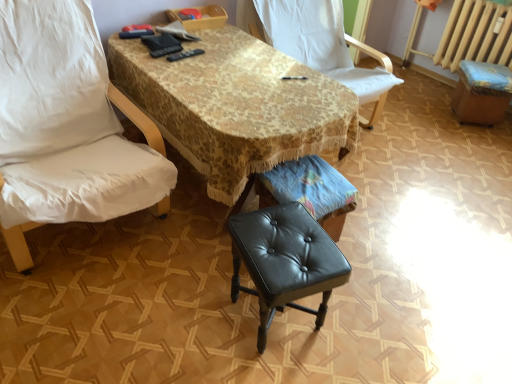
Question: Is black leather music stool at center oriented away from gold lace tablecloth at center?

Choices:
 (A) no
 (B) yes

Answer: (B)

Question: From a real-world perspective, does black leather music stool at center stand above gold lace tablecloth at center?

Choices:
 (A) yes
 (B) no

Answer: (B)

Question: Does black leather music stool at center have a smaller size compared to gold lace tablecloth at center?

Choices:
 (A) yes
 (B) no

Answer: (A)

Question: Does black leather music stool at center have a greater width compared to gold lace tablecloth at center?

Choices:
 (A) yes
 (B) no

Answer: (B)

Question: Is the depth of black leather music stool at center greater than that of gold lace tablecloth at center?

Choices:
 (A) yes
 (B) no

Answer: (A)

Question: Are black leather music stool at center and gold lace tablecloth at center far apart?

Choices:
 (A) no
 (B) yes

Answer: (A)

Question: From the image's perspective, is black leather music stool at center on top of black leather bar stool at lower right?

Choices:
 (A) yes
 (B) no

Answer: (B)

Question: From a real-world perspective, is black leather music stool at center beneath black leather bar stool at lower right?

Choices:
 (A) no
 (B) yes

Answer: (B)

Question: From a real-world perspective, is black leather music stool at center physically above black leather bar stool at lower right?

Choices:
 (A) no
 (B) yes

Answer: (A)

Question: Would you say black leather music stool at center is a long distance from black leather bar stool at lower right?

Choices:
 (A) yes
 (B) no

Answer: (A)

Question: Is black leather music stool at center wider than black leather bar stool at lower right?

Choices:
 (A) yes
 (B) no

Answer: (B)

Question: Would you say black leather music stool at center contains black leather bar stool at lower right?

Choices:
 (A) no
 (B) yes

Answer: (A)

Question: Considering the relative sizes of black leather bar stool at lower right and black leather stool at center in the image provided, is black leather bar stool at lower right shorter than black leather stool at center?

Choices:
 (A) no
 (B) yes

Answer: (B)